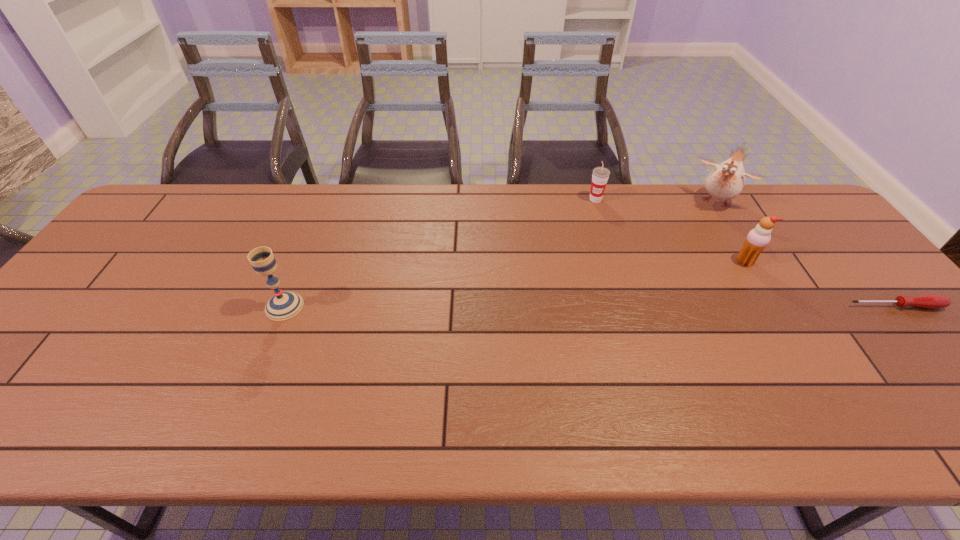
Find the location of a particular element. This screenshot has height=540, width=960. the leftmost object is located at coordinates (283, 305).

This screenshot has height=540, width=960. Identify the location of the shortest object. (930, 301).

At what (x,y) coordinates should I click in order to perform the action: click on the rightmost object. Please return your answer as a coordinate pair (x, y). The width and height of the screenshot is (960, 540). Looking at the image, I should click on (930, 301).

Identify the location of bird. click(x=726, y=181).

This screenshot has height=540, width=960. I want to click on the third farthest object, so click(x=758, y=238).

At what (x,y) coordinates should I click in order to perform the action: click on cup. Please return your answer as a coordinate pair (x, y). The width and height of the screenshot is (960, 540). Looking at the image, I should click on (600, 175).

At what (x,y) coordinates should I click in order to perform the action: click on the fourth object from right to left. Please return your answer as a coordinate pair (x, y). Looking at the image, I should click on (600, 175).

Find the location of a particular element. This screenshot has height=540, width=960. vacant space located on the right of the leftmost object is located at coordinates (343, 306).

Identify the location of free location located 0.190m at the tip of the screwdriver. The height and width of the screenshot is (540, 960). (956, 379).

Locate an element on the screen. This screenshot has width=960, height=540. blank area located at the beak of the bird is located at coordinates (684, 252).